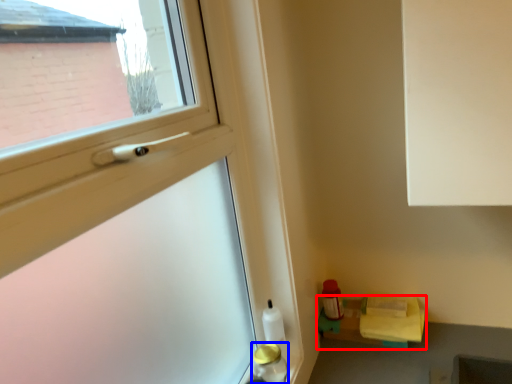
Question: Which of the following is the closest to the observer, shelf (highlighted by a red box) or bottle (highlighted by a blue box)?

Choices:
 (A) shelf
 (B) bottle

Answer: (B)